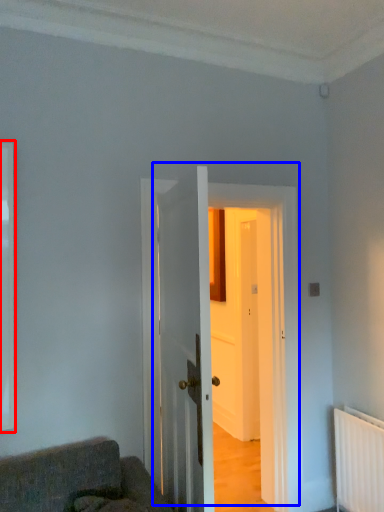
Question: Which object is further to the camera taking this photo, window (highlighted by a red box) or door (highlighted by a blue box)?

Choices:
 (A) window
 (B) door

Answer: (B)